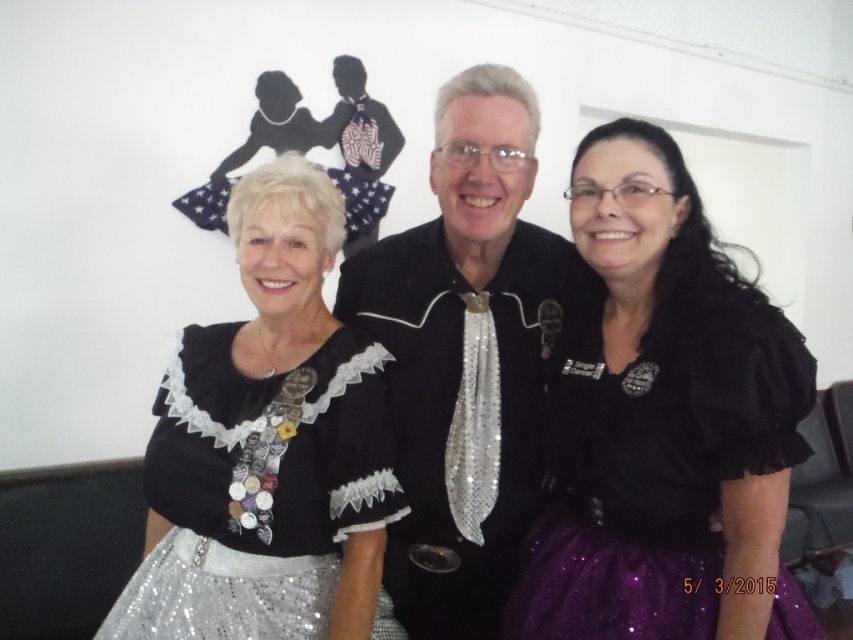
Between shiny purple skirt at center and black sequined jacket at center, which one appears on the left side from the viewer's perspective?

Positioned to the left is black sequined jacket at center.

Is shiny purple skirt at center to the left of black sequined jacket at center from the viewer's perspective?

No, shiny purple skirt at center is not to the left of black sequined jacket at center.

Is point (624, 262) in front of point (418, 577)?

Yes, it is.

The image size is (853, 640). Identify the location of shiny purple skirt at center. (665, 422).

Can you confirm if shiny purple skirt at center is positioned to the right of silver sequined dress at lower left?

Indeed, shiny purple skirt at center is positioned on the right side of silver sequined dress at lower left.

Is shiny purple skirt at center shorter than silver sequined dress at lower left?

Incorrect, shiny purple skirt at center's height does not fall short of silver sequined dress at lower left's.

Identify the location of shiny purple skirt at center. (665, 422).

Who is more distant from viewer, (x=447, y=387) or (x=326, y=500)?

Point (x=447, y=387)

Which of these two, black sequined jacket at center or silver sequined dress at lower left, stands taller?

black sequined jacket at center is taller.

The width and height of the screenshot is (853, 640). What do you see at coordinates (465, 356) in the screenshot? I see `black sequined jacket at center` at bounding box center [465, 356].

Where is `black sequined jacket at center`? This screenshot has width=853, height=640. black sequined jacket at center is located at coordinates (465, 356).